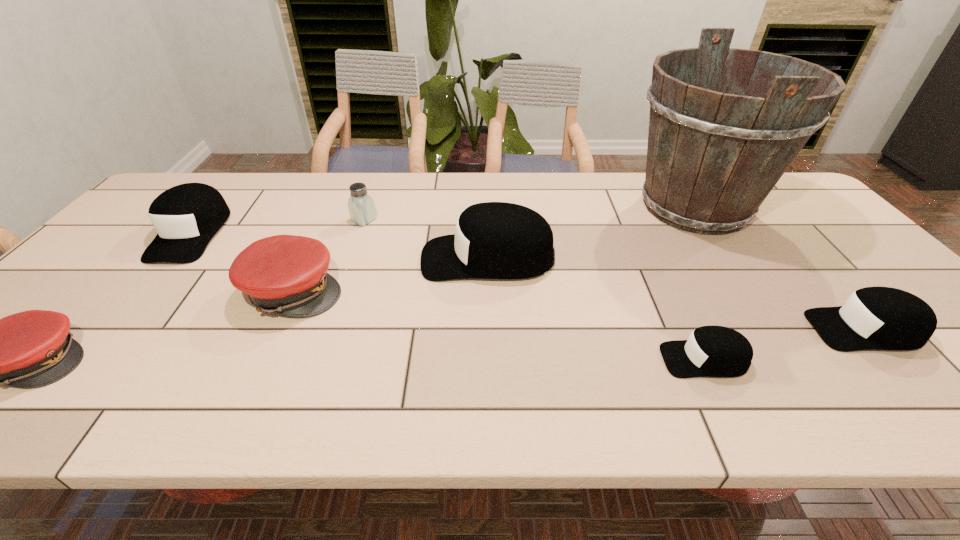
Where is `object that is positioned at the far right corner`? The image size is (960, 540). object that is positioned at the far right corner is located at coordinates (714, 154).

Find the location of a particular element. This screenshot has width=960, height=540. vacant space at the far edge of the desktop is located at coordinates (504, 187).

I want to click on vacant space at the left edge of the desktop, so click(x=128, y=239).

Locate an element on the screen. This screenshot has height=540, width=960. unoccupied position between the leftmost black cap and the rightmost black cap is located at coordinates click(528, 281).

The height and width of the screenshot is (540, 960). Find the location of `free space between the second black cap from right to left and the right red cap`. free space between the second black cap from right to left and the right red cap is located at coordinates (499, 325).

Locate an element on the screen. vacant region between the smallest black cap and the second smallest black cap is located at coordinates [784, 345].

Locate an element on the screen. Image resolution: width=960 pixels, height=540 pixels. empty space that is in between the second biggest black cap and the second cap from right to left is located at coordinates point(447,296).

Image resolution: width=960 pixels, height=540 pixels. In order to click on vacant region between the rightmost cap and the seventh shortest object in this screenshot , I will do `click(676, 294)`.

The height and width of the screenshot is (540, 960). I want to click on free spot between the fourth object from right to left and the bucket, so click(x=591, y=233).

Image resolution: width=960 pixels, height=540 pixels. I want to click on vacant area between the leftmost black cap and the third black cap from left to right, so click(447, 296).